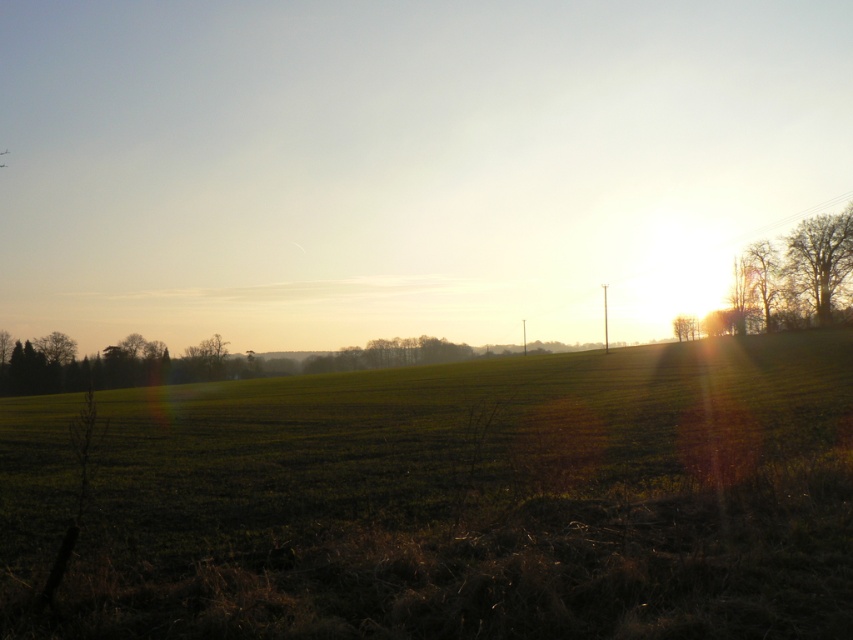
Between green grass at center and bare branches at right, which one is positioned lower?

green grass at center is lower down.

Can you confirm if green grass at center is positioned above bare branches at right?

Incorrect, green grass at center is not positioned above bare branches at right.

Between point (711, 499) and point (804, 259), which one is positioned behind?

The point (804, 259) is more distant.

At what (x,y) coordinates should I click in order to perform the action: click on green grass at center. Please return your answer as a coordinate pair (x, y). This screenshot has width=853, height=640. Looking at the image, I should click on (450, 499).